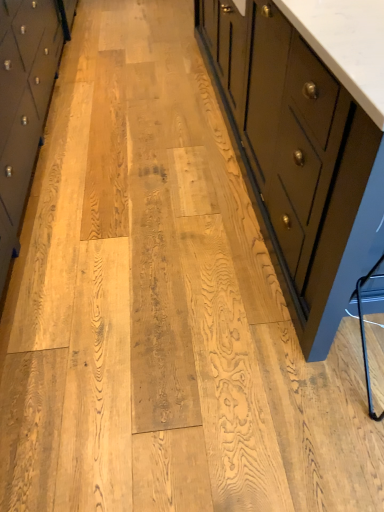
Question: Do you think matte black cabinet at right, the first chest of drawers when ordered from right to left, is within matte black cabinet at left, the first chest of drawers in the left-to-right sequence, or outside of it?

Choices:
 (A) outside
 (B) inside

Answer: (A)

Question: Is matte black cabinet at right, which is the second chest of drawers in left-to-right order, taller or shorter than matte black cabinet at left, the first chest of drawers in the left-to-right sequence?

Choices:
 (A) short
 (B) tall

Answer: (B)

Question: From the image's perspective, is matte black cabinet at right, the first chest of drawers when ordered from right to left, positioned above or below matte black cabinet at left, the first chest of drawers in the left-to-right sequence?

Choices:
 (A) above
 (B) below

Answer: (A)

Question: In terms of height, does matte black cabinet at left, acting as the 2th chest of drawers starting from the right, look taller or shorter compared to matte black cabinet at right, which is the second chest of drawers in left-to-right order?

Choices:
 (A) short
 (B) tall

Answer: (A)

Question: Would you say matte black cabinet at left, the first chest of drawers in the left-to-right sequence, is to the left or to the right of matte black cabinet at right, the first chest of drawers when ordered from right to left, in the picture?

Choices:
 (A) right
 (B) left

Answer: (B)

Question: Looking at the image, does matte black cabinet at left, acting as the 2th chest of drawers starting from the right, seem bigger or smaller compared to matte black cabinet at right, which is the second chest of drawers in left-to-right order?

Choices:
 (A) big
 (B) small

Answer: (B)

Question: From a real-world perspective, relative to matte black cabinet at right, the first chest of drawers when ordered from right to left, is matte black cabinet at left, the first chest of drawers in the left-to-right sequence, vertically above or below?

Choices:
 (A) above
 (B) below

Answer: (B)